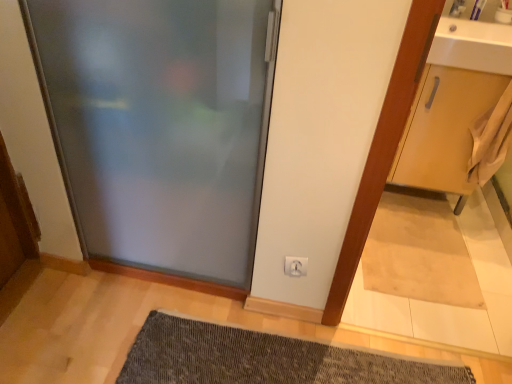
This screenshot has height=384, width=512. Find the location of `vacant space in front of light brown wood cabinet at right`. vacant space in front of light brown wood cabinet at right is located at coordinates (426, 238).